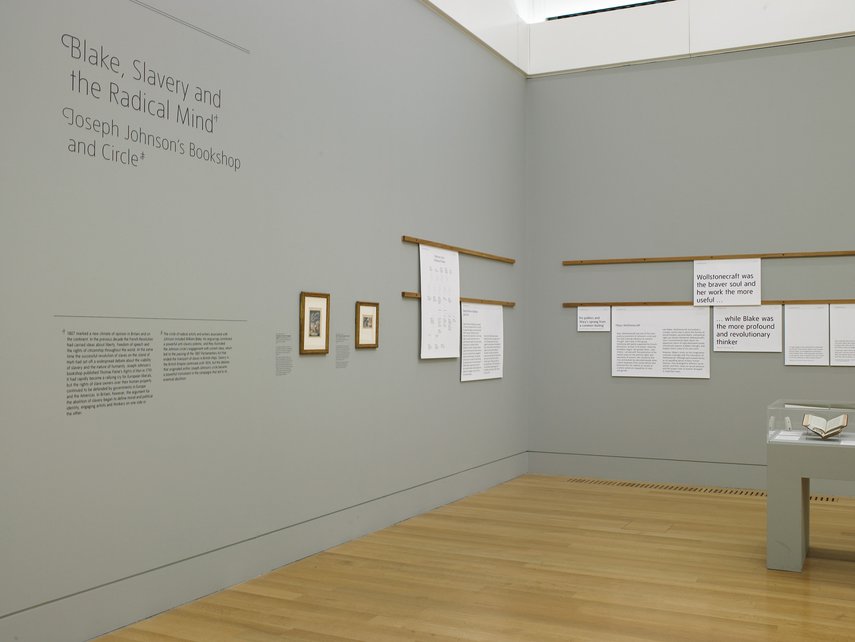
At what (x,y) coordinates should I click in order to perform the action: click on 2 pages opened in display case. Please return your answer as a coordinate pair (x, y). Looking at the image, I should click on point(815,420), point(832,420).